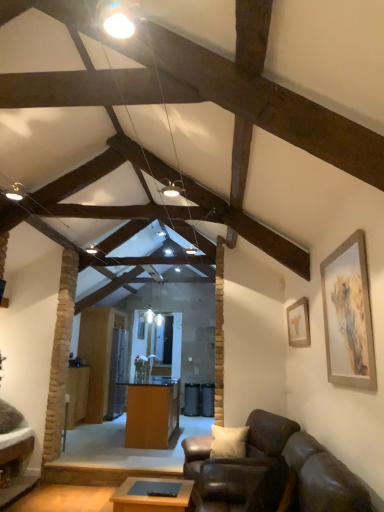
Question: Could you tell me if wooden table at center, which is the 1th table from front to back, is turned towards leather couch at lower right?

Choices:
 (A) no
 (B) yes

Answer: (A)

Question: Considering the relative sizes of wooden table at center, placed as the 2th table when sorted from left to right, and leather couch at lower right in the image provided, is wooden table at center, placed as the 2th table when sorted from left to right, shorter than leather couch at lower right?

Choices:
 (A) no
 (B) yes

Answer: (B)

Question: Does wooden table at center, placed as the 2th table when sorted from left to right, have a greater width compared to leather couch at lower right?

Choices:
 (A) yes
 (B) no

Answer: (B)

Question: Is wooden table at center, placed as the 2th table when sorted from left to right, behind leather couch at lower right?

Choices:
 (A) yes
 (B) no

Answer: (A)

Question: Does wooden table at center, placed as the 2th table when sorted from left to right, have a smaller size compared to leather couch at lower right?

Choices:
 (A) no
 (B) yes

Answer: (B)

Question: From a real-world perspective, is wooden table at center, the second table in the back-to-front sequence, over leather couch at lower right?

Choices:
 (A) yes
 (B) no

Answer: (B)

Question: Is orange wood desk at center at the back of matte gold picture frame at upper right, marked as the 1th picture frame in a right-to-left arrangement?

Choices:
 (A) no
 (B) yes

Answer: (A)

Question: Is matte gold picture frame at upper right, the second picture frame when ordered from left to right, positioned in front of orange wood desk at center?

Choices:
 (A) no
 (B) yes

Answer: (B)

Question: Is orange wood desk at center a part of matte gold picture frame at upper right, marked as the 1th picture frame in a right-to-left arrangement?

Choices:
 (A) no
 (B) yes

Answer: (A)

Question: Does matte gold picture frame at upper right, the second picture frame when ordered from left to right, appear on the right side of orange wood desk at center?

Choices:
 (A) no
 (B) yes

Answer: (B)

Question: From the image's perspective, is matte gold picture frame at upper right, the second picture frame when ordered from left to right, under orange wood desk at center?

Choices:
 (A) no
 (B) yes

Answer: (A)

Question: From the image's perspective, is matte gold picture frame at upper right, marked as the 1th picture frame in a right-to-left arrangement, on top of orange wood desk at center?

Choices:
 (A) no
 (B) yes

Answer: (B)

Question: Does leather couch at lower right have a greater height compared to wooden table at center, the 2th table from the right?

Choices:
 (A) yes
 (B) no

Answer: (B)